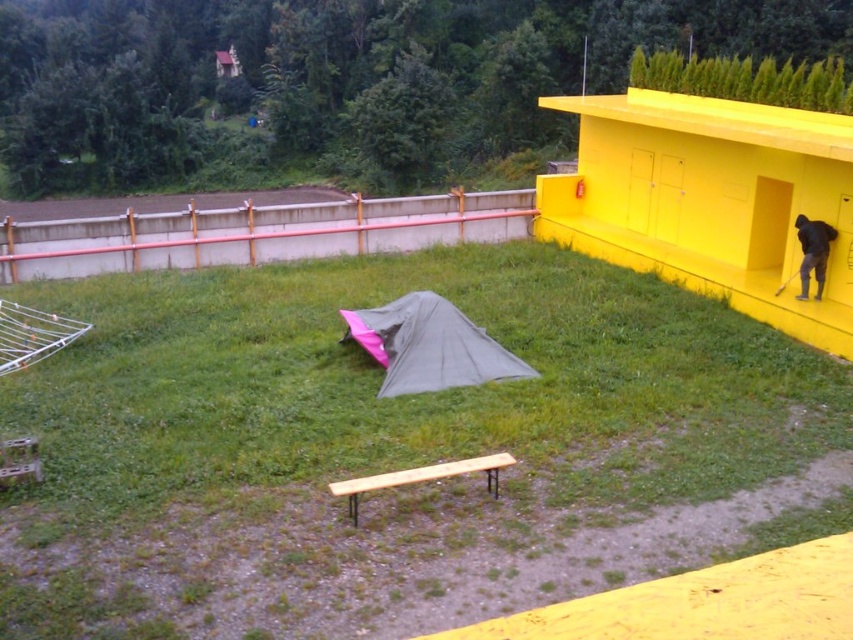
You are planning to set up a picnic blanket between the green grassy at center and the dark gray fabric at right. The picnic blanket requires 3 meters of space. Is there enough space between them to place the blanket?

The green grassy at center and dark gray fabric at right are 4.29 meters apart from each other. Since the required space is 3 meters, there is enough space to place the picnic blanket between them.